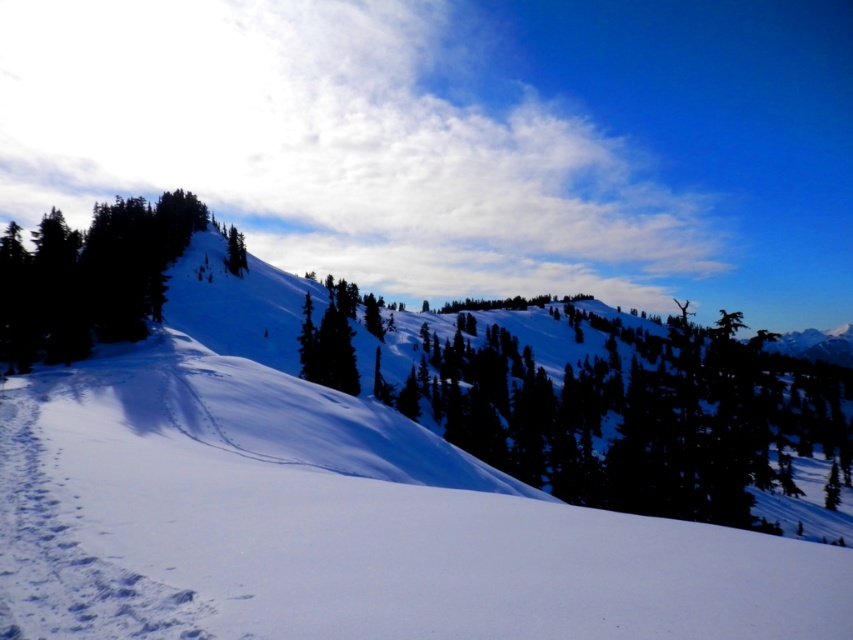
Can you confirm if green matte tree at center is smaller than green matte tree at upper center?

Yes, green matte tree at center is smaller than green matte tree at upper center.

Is point (305, 305) positioned behind point (236, 266)?

No, it is not.

At what (x,y) coordinates should I click in order to perform the action: click on green matte tree at center. Please return your answer as a coordinate pair (x, y). Looking at the image, I should click on (328, 349).

Can you confirm if white powdery snow at center is positioned to the left of green matte tree at upper left?

No, white powdery snow at center is not to the left of green matte tree at upper left.

Can you confirm if white powdery snow at center is shorter than green matte tree at upper left?

Indeed, white powdery snow at center has a lesser height compared to green matte tree at upper left.

Which is behind, point (389, 554) or point (90, 250)?

Positioned behind is point (90, 250).

The width and height of the screenshot is (853, 640). I want to click on white powdery snow at center, so click(332, 513).

Measure the distance between point (486,528) and camera.

A distance of 14.29 meters exists between point (486,528) and camera.

Between point (344, 422) and point (338, 310), which one is positioned behind?

Point (338, 310)

At what (x,y) coordinates should I click in order to perform the action: click on white powdery snow at center. Please return your answer as a coordinate pair (x, y). Looking at the image, I should click on (332, 513).